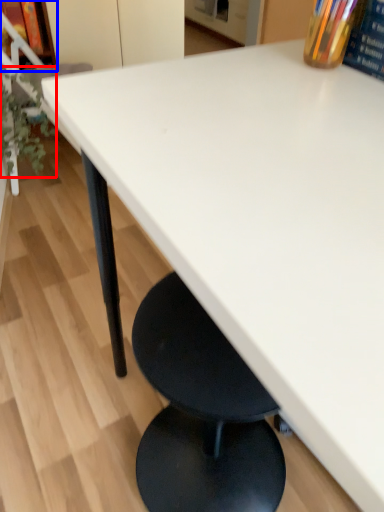
Question: Among these objects, which one is nearest to the camera, plant (highlighted by a red box) or shelf (highlighted by a blue box)?

Choices:
 (A) plant
 (B) shelf

Answer: (A)